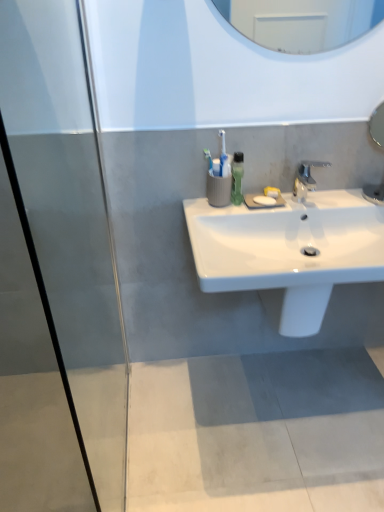
Question: From the image's perspective, would you say silver metallic faucet at center is positioned over white glossy sink at center?

Choices:
 (A) no
 (B) yes

Answer: (B)

Question: Are silver metallic faucet at center and white glossy sink at center located far from each other?

Choices:
 (A) yes
 (B) no

Answer: (B)

Question: Does silver metallic faucet at center have a smaller size compared to white glossy sink at center?

Choices:
 (A) no
 (B) yes

Answer: (B)

Question: Does silver metallic faucet at center have a greater width compared to white glossy sink at center?

Choices:
 (A) no
 (B) yes

Answer: (A)

Question: Could you tell me if silver metallic faucet at center is facing white glossy sink at center?

Choices:
 (A) yes
 (B) no

Answer: (B)

Question: Is silver metallic faucet at center shorter than white glossy sink at center?

Choices:
 (A) no
 (B) yes

Answer: (A)

Question: Is white glossy sink at center shorter than silver metallic faucet at center?

Choices:
 (A) no
 (B) yes

Answer: (B)

Question: Does white glossy sink at center come behind silver metallic faucet at center?

Choices:
 (A) no
 (B) yes

Answer: (A)

Question: Considering the relative sizes of white glossy sink at center and silver metallic faucet at center in the image provided, is white glossy sink at center thinner than silver metallic faucet at center?

Choices:
 (A) yes
 (B) no

Answer: (B)

Question: Could you tell me if white glossy sink at center is turned towards silver metallic faucet at center?

Choices:
 (A) yes
 (B) no

Answer: (B)

Question: Is white glossy sink at center taller than silver metallic faucet at center?

Choices:
 (A) no
 (B) yes

Answer: (A)

Question: From the image's perspective, is white glossy sink at center over silver metallic faucet at center?

Choices:
 (A) yes
 (B) no

Answer: (B)

Question: Considering the relative sizes of silver metallic faucet at center and green matte soap dispenser at upper center in the image provided, is silver metallic faucet at center bigger than green matte soap dispenser at upper center?

Choices:
 (A) no
 (B) yes

Answer: (B)